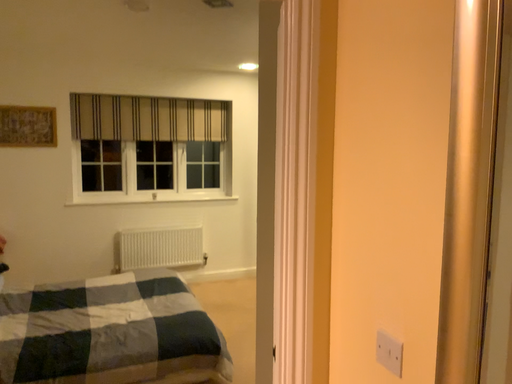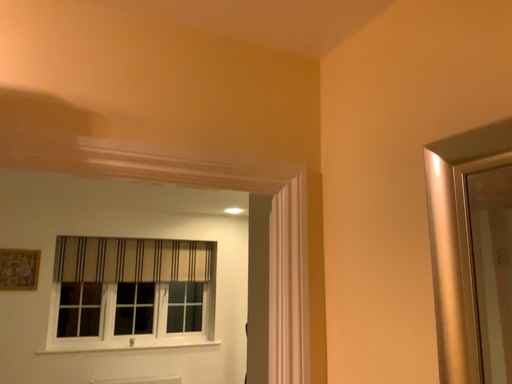
Question: Which way did the camera rotate in the video?

Choices:
 (A) rotated downward
 (B) rotated upward

Answer: (B)